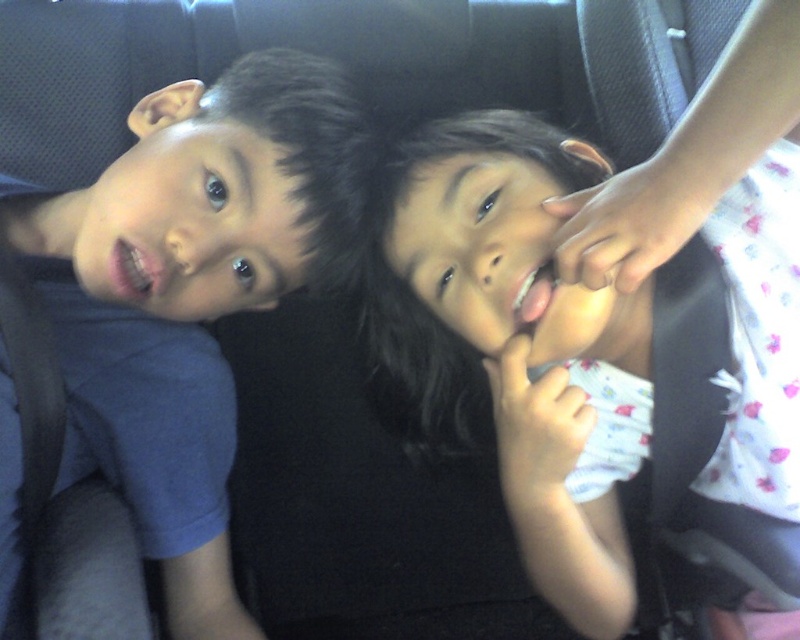
In the car scene, you see the white floral dress at center and the blue matte shirt at left. Which one is positioned more to the right side?

The white floral dress at center is positioned more to the right side than the blue matte shirt at left.

You are a photographer trying to capture a closeup of the blue matte shirt at left in the car backseat. The camera is currently focused on the point at coordinates point (192, 291). Is this point on the blue matte shirt at left?

Yes, the point (192, 291) is on the blue matte shirt at left, so the camera is focused on the correct area.

You are a parent trying to choose which child to hand a toy to. The toy is placed between the white floral dress at center and the blue matte shirt at left. Which child should you hand the toy to if you want to give it to the child wearing the larger clothing item?

The white floral dress at center is bigger than the blue matte shirt at left, so you should hand the toy to the child wearing the white floral dress at center.